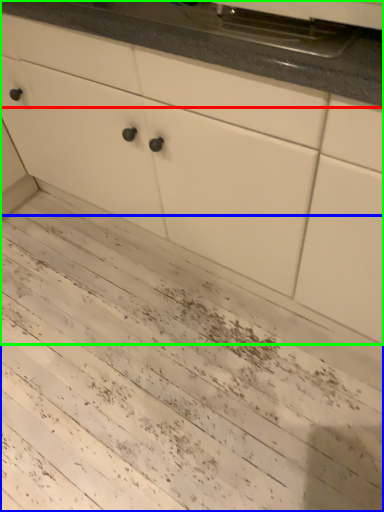
Question: Which is farther away from countertop (highlighted by a red box)? mud (highlighted by a blue box) or cabinetry (highlighted by a green box)?

Choices:
 (A) mud
 (B) cabinetry

Answer: (A)